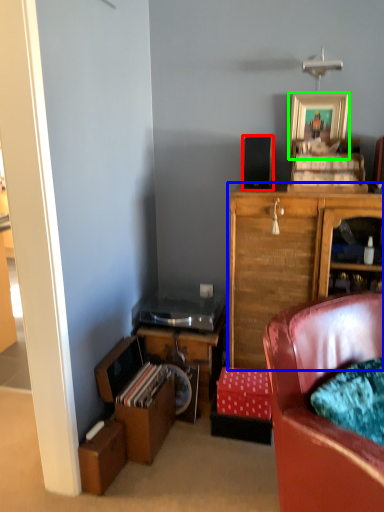
Question: Estimate the real-world distances between objects in this image. Which object is farther from loudspeaker (highlighted by a red box), cabinetry (highlighted by a blue box) or picture frame (highlighted by a green box)?

Choices:
 (A) cabinetry
 (B) picture frame

Answer: (A)